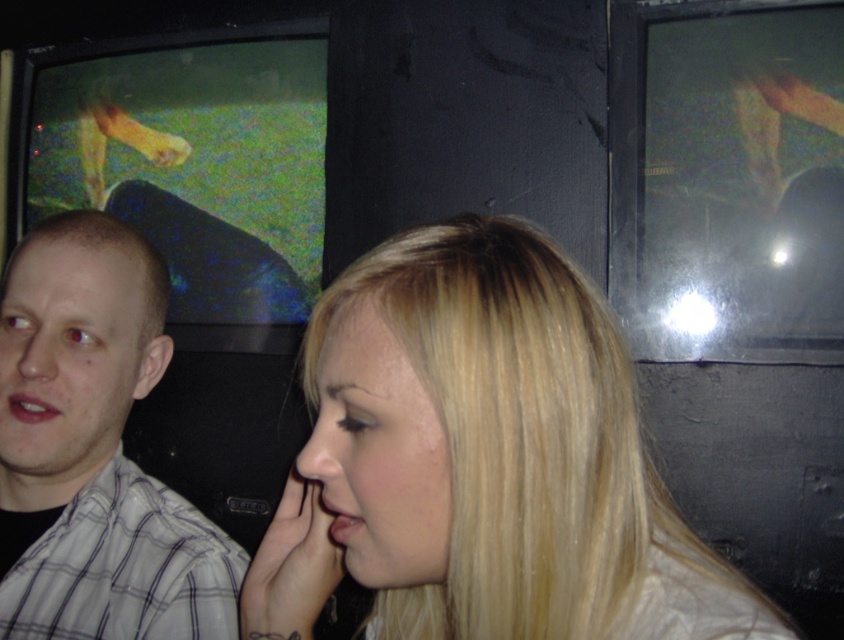
You are a photographer trying to capture a candid shot of the blonde hair at center and the white checkered shirt at left. Based on their heights, which object should you position your camera closer to in order to frame both subjects equally in the photo?

The blonde hair at center has a lesser height compared to the white checkered shirt at left. To frame both subjects equally, you should position your camera closer to the blonde hair at center to compensate for its shorter height.

You are a photographer trying to capture a candid shot of the two people in the scene. You want to ensure that the blonde hair at center and the white checkered shirt at left are both visible in the frame. Based on their positions, which object should you focus on first to ensure both are in the shot?

The blonde hair at center is below the white checkered shirt at left, so focusing on the white checkered shirt at left first will ensure both are included in the frame since the blonde hair at center is positioned below it.

You are a photographer trying to capture a candid shot of the two people in the scene. Your camera has a maximum focus range of 30 centimeters. Can you focus on both the blonde hair at center and the white checkered shirt at left simultaneously?

The distance between the blonde hair at center and the white checkered shirt at left is 30.20 centimeters. Since the camera can only focus within 30 centimeters, it cannot capture both subjects in focus at the same time.